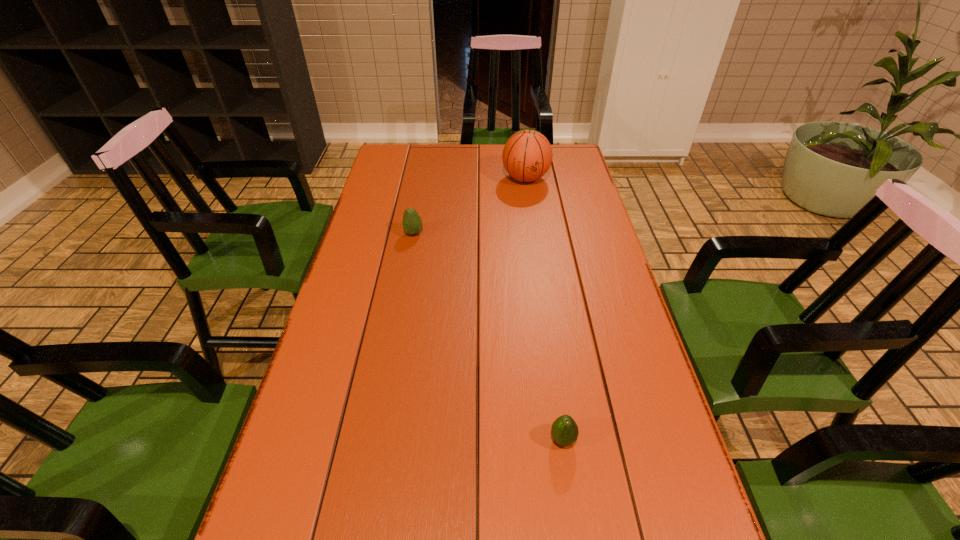
Where is `free space between the farther avocado and the tallest object`? This screenshot has width=960, height=540. free space between the farther avocado and the tallest object is located at coordinates (469, 206).

In order to click on vacant space that is in between the leftmost object and the right avocado in this screenshot , I will do `click(489, 336)`.

Identify the location of free space that is in between the farthest object and the left avocado. The height and width of the screenshot is (540, 960). (469, 206).

You are a GUI agent. You are given a task and a screenshot of the screen. Output one action in this format:
    pyautogui.click(x=<x>, y=<y>)
    Task: Click on the free point between the nearest object and the farther avocado
    Image resolution: width=960 pixels, height=540 pixels.
    Given the screenshot: What is the action you would take?
    pyautogui.click(x=489, y=336)

Where is `free space between the tallest object and the farther avocado`? The height and width of the screenshot is (540, 960). free space between the tallest object and the farther avocado is located at coordinates (469, 206).

You are a GUI agent. You are given a task and a screenshot of the screen. Output one action in this format:
    pyautogui.click(x=<x>, y=<y>)
    Task: Click on the vacant area that lies between the nearest object and the leftmost object
    This screenshot has height=540, width=960.
    Given the screenshot: What is the action you would take?
    pyautogui.click(x=489, y=336)

Image resolution: width=960 pixels, height=540 pixels. I want to click on vacant point located between the nearer avocado and the leftmost object, so click(489, 336).

Image resolution: width=960 pixels, height=540 pixels. Find the location of `free space between the second nearest object and the farthest object`. free space between the second nearest object and the farthest object is located at coordinates (469, 206).

Identify the location of object that is the closest to the basketball. The height and width of the screenshot is (540, 960). (412, 224).

Locate which object ranks second in proximity to the tallest object. Please provide its 2D coordinates. Your answer should be formatted as a tuple, i.e. [(x, y)], where the tuple contains the x and y coordinates of a point satisfying the conditions above.

[(564, 430)]